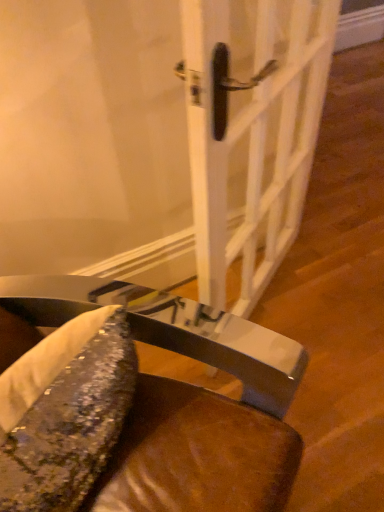
Question: Can you confirm if metallic sequined cushion at lower center is thinner than white glossy door handle at center?

Choices:
 (A) no
 (B) yes

Answer: (A)

Question: From the image's perspective, would you say metallic sequined cushion at lower center is shown under white glossy door handle at center?

Choices:
 (A) yes
 (B) no

Answer: (A)

Question: Is metallic sequined cushion at lower center with white glossy door handle at center?

Choices:
 (A) no
 (B) yes

Answer: (A)

Question: Does metallic sequined cushion at lower center appear on the left side of white glossy door handle at center?

Choices:
 (A) yes
 (B) no

Answer: (A)

Question: Would you say metallic sequined cushion at lower center is a long distance from white glossy door handle at center?

Choices:
 (A) yes
 (B) no

Answer: (B)

Question: In the image, is shiny metallic fish at lower left positioned in front of or behind white glossy door handle at center?

Choices:
 (A) front
 (B) behind

Answer: (A)

Question: Is shiny metallic fish at lower left spatially inside white glossy door handle at center, or outside of it?

Choices:
 (A) inside
 (B) outside

Answer: (B)

Question: From the image's perspective, is shiny metallic fish at lower left positioned above or below white glossy door handle at center?

Choices:
 (A) above
 (B) below

Answer: (B)

Question: Considering the positions of point (84, 413) and point (195, 35), is point (84, 413) closer or farther from the camera than point (195, 35)?

Choices:
 (A) farther
 (B) closer

Answer: (B)

Question: Considering the positions of metallic sequined cushion at lower center and white glossy door handle at center in the image, is metallic sequined cushion at lower center bigger or smaller than white glossy door handle at center?

Choices:
 (A) small
 (B) big

Answer: (B)

Question: Considering the relative positions of metallic sequined cushion at lower center and white glossy door handle at center in the image provided, is metallic sequined cushion at lower center to the left or to the right of white glossy door handle at center?

Choices:
 (A) right
 (B) left

Answer: (B)

Question: Is metallic sequined cushion at lower center taller or shorter than white glossy door handle at center?

Choices:
 (A) tall
 (B) short

Answer: (B)

Question: Is metallic sequined cushion at lower center inside or outside of white glossy door handle at center?

Choices:
 (A) inside
 (B) outside

Answer: (B)

Question: Is white glossy door handle at center to the left or to the right of metallic sequined cushion at lower center in the image?

Choices:
 (A) left
 (B) right

Answer: (B)

Question: From a real-world perspective, is white glossy door handle at center physically located above or below metallic sequined cushion at lower center?

Choices:
 (A) above
 (B) below

Answer: (A)